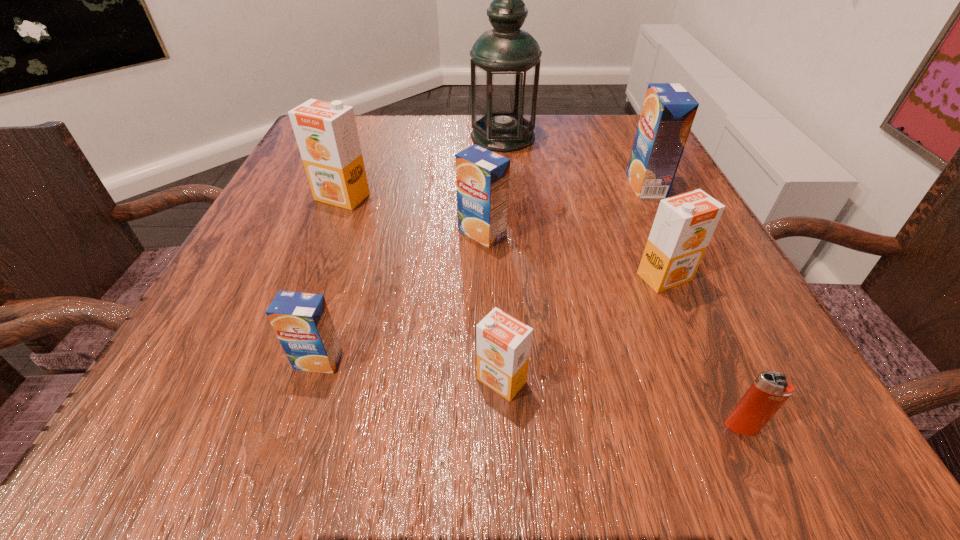
At what (x,y) coordinates should I click in order to perform the action: click on vacant space located on the back of the leftmost blue orange_juice. Please return your answer as a coordinate pair (x, y). The image size is (960, 540). Looking at the image, I should click on (365, 213).

Image resolution: width=960 pixels, height=540 pixels. In order to click on vacant space located 0.270m on the right of the second orange orange juice from right to left in this screenshot , I will do `click(746, 380)`.

The height and width of the screenshot is (540, 960). I want to click on vacant space located 0.230m on the back of the nearest object, so click(x=674, y=279).

The height and width of the screenshot is (540, 960). What are the coordinates of `object located at the far edge` in the screenshot? It's located at (505, 61).

At what (x,y) coordinates should I click in order to perform the action: click on orange juice located in the near edge section of the desktop. Please return your answer as a coordinate pair (x, y). Looking at the image, I should click on (503, 343).

Where is `igniter situated at the near edge`? This screenshot has height=540, width=960. igniter situated at the near edge is located at coordinates (770, 390).

Find the location of a particular element. This screenshot has width=960, height=540. igniter that is at the right edge is located at coordinates (770, 390).

This screenshot has width=960, height=540. I want to click on object that is at the near right corner, so click(770, 390).

You are a GUI agent. You are given a task and a screenshot of the screen. Output one action in this format:
    pyautogui.click(x=<x>, y=<y>)
    Task: Click on the free space at the far edge of the desktop
    
    Given the screenshot: What is the action you would take?
    pyautogui.click(x=540, y=123)

You are a GUI agent. You are given a task and a screenshot of the screen. Output one action in this format:
    pyautogui.click(x=<x>, y=<y>)
    Task: Click on the vacant space at the near edge of the desktop
    This screenshot has width=960, height=540.
    Given the screenshot: What is the action you would take?
    pyautogui.click(x=315, y=406)